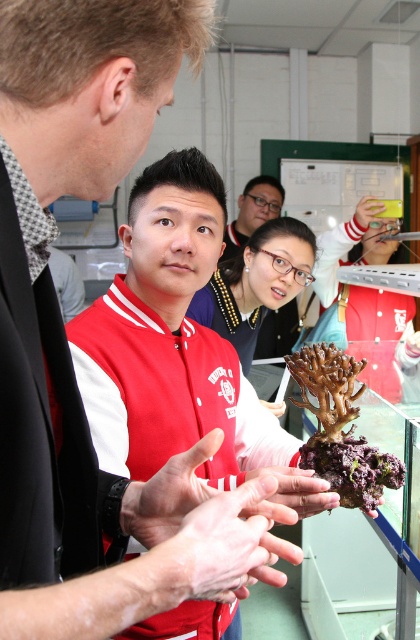
You are an artist trying to sketch the scene. You need to decide which object to draw first based on their sizes. According to the scene, which object should you start with, the matte red jacket at center or the matte black hand at center?

The matte red jacket at center is larger than the matte black hand at center, so you should start with the matte red jacket at center to ensure proper scaling in your drawing.

You are a researcher who needs to measure the distance between your eyes and the point in the image labeled as point (31, 264). Based on the scene description provided, can you determine if this distance is less than 50 centimeters?

The distance of point (31, 264) from viewer is 46.58 centimeters, so yes, the distance is less than 50 centimeters.

You are an artist trying to sketch the scene. You notice the matte red jacket at center and the smooth skin hand at center. Which object should you draw first if you want to capture the larger one first?

The matte red jacket at center is bigger than the smooth skin hand at center, so you should draw the matte red jacket at center first.